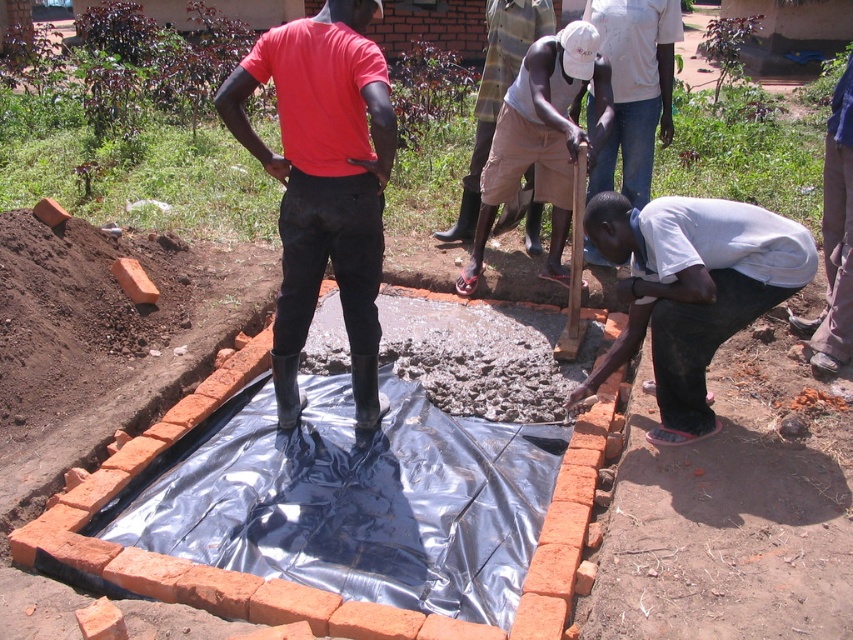
You are a safety inspector checking the construction site. You notice the rubber boots at center and the white matte shirt at lower right. Which item is taller in the image?

The rubber boots at center has a greater height compared to the white matte shirt at lower right, so the rubber boots at center is taller.

You are a safety inspector checking the construction site. You notice two items at the center of the image labeled as rubber boots at center and light brown cotton shorts at center. Which item appears smaller in size?

The rubber boots at center is smaller than light brown cotton shorts at center according to the description.

You are a safety inspector assessing the construction site. You notice two workers wearing the white matte shirt at lower right and the light brown cotton shorts at center. Which worker is more likely to be wearing clothing that meets the safety standards for visibility? Explain your reasoning based on their clothing size and the scene description.

The light brown cotton shorts at center are larger in size than the white matte shirt at lower right. Since visibility is crucial on construction sites, the worker wearing the larger clothing item might have a better chance of meeting safety standards as larger clothing can be more visible from a distance. However, the actual compliance would depend on the specific color and design of the clothing relative to the site environment described.